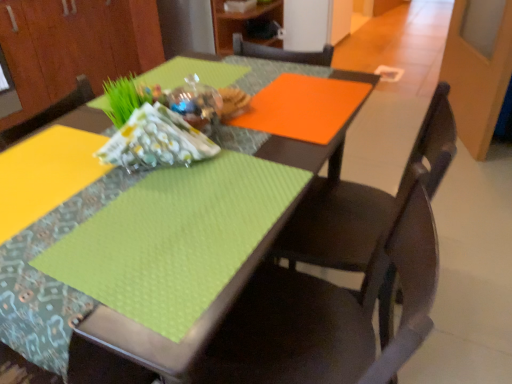
The image size is (512, 384). Describe the element at coordinates (156, 141) in the screenshot. I see `patterned fabric at center` at that location.

What is the approximate width of patterned fabric at center?

The width of patterned fabric at center is 2.16 inches.

The height and width of the screenshot is (384, 512). What do you see at coordinates (362, 202) in the screenshot?
I see `matte black chair at center, the first chair from the back` at bounding box center [362, 202].

This screenshot has height=384, width=512. Describe the element at coordinates (243, 24) in the screenshot. I see `matte wood cabinet at upper center, which appears as the first cabinetry when viewed from the right` at that location.

Where is `matte green placemat at lower left, which appears as the second chair when viewed from the back`? This screenshot has width=512, height=384. matte green placemat at lower left, which appears as the second chair when viewed from the back is located at coordinates (330, 313).

Could you measure the distance between matte wood cabinet at upper left, the second cabinetry positioned from the right, and patterned fabric at center?

7.29 feet.

Is matte wood cabinet at upper left, the second cabinetry positioned from the right, looking in the opposite direction of patterned fabric at center?

That's not correct — matte wood cabinet at upper left, the second cabinetry positioned from the right, is not looking away from patterned fabric at center.

Is patterned fabric at center completely or partially inside matte wood cabinet at upper left, which is the 1th cabinetry from left to right?

Definitely not — patterned fabric at center is not inside matte wood cabinet at upper left, which is the 1th cabinetry from left to right.

Looking at this image, is matte wood cabinet at upper left, the second cabinetry positioned from the right, thinner than patterned fabric at center?

In fact, matte wood cabinet at upper left, the second cabinetry positioned from the right, might be wider than patterned fabric at center.

Is matte black chair at center, which is the second chair from front to back, wider or thinner than patterned fabric at center?

Considering their sizes, matte black chair at center, which is the second chair from front to back, looks broader than patterned fabric at center.

Considering the relative sizes of matte black chair at center, the first chair from the back, and patterned fabric at center in the image provided, is matte black chair at center, the first chair from the back, taller than patterned fabric at center?

Indeed, matte black chair at center, the first chair from the back, has a greater height compared to patterned fabric at center.

Considering the positions of point (356, 238) and point (135, 114), is point (356, 238) closer or farther from the camera than point (135, 114)?

Point (356, 238) appears to be farther away from the viewer than point (135, 114).

Is matte black chair at center, which is the second chair from front to back, far away from patterned fabric at center?

No, matte black chair at center, which is the second chair from front to back, is not far from patterned fabric at center.

Is matte green placemat at lower left, which appears as the second chair when viewed from the back, completely or partially inside matte wood cabinet at upper left, the second cabinetry positioned from the right?

No.

Based on their sizes in the image, would you say matte wood cabinet at upper left, the second cabinetry positioned from the right, is bigger or smaller than matte green placemat at lower left, which appears as the second chair when viewed from the back?

Considering their sizes, matte wood cabinet at upper left, the second cabinetry positioned from the right, takes up more space than matte green placemat at lower left, which appears as the second chair when viewed from the back.

Locate an element on the screen. the 1st cabinetry positioned above the matte green placemat at lower left, positioned as the first chair in front-to-back order (from the image's perspective) is located at coordinates (74, 46).

Can you confirm if matte wood cabinet at upper left, the second cabinetry positioned from the right, is taller than matte green placemat at lower left, which appears as the second chair when viewed from the back?

No.

How much distance is there between matte green placemat at lower left, positioned as the first chair in front-to-back order, and patterned fabric at center?

matte green placemat at lower left, positioned as the first chair in front-to-back order, and patterned fabric at center are 16.17 inches apart from each other.

Which object is closer to the camera, matte green placemat at lower left, positioned as the first chair in front-to-back order, or patterned fabric at center?

matte green placemat at lower left, positioned as the first chair in front-to-back order, is in front.

In terms of width, does matte green placemat at lower left, which appears as the second chair when viewed from the back, look wider or thinner when compared to patterned fabric at center?

matte green placemat at lower left, which appears as the second chair when viewed from the back, is wider than patterned fabric at center.

From a real-world perspective, is matte green placemat at lower left, which appears as the second chair when viewed from the back, physically below patterned fabric at center?

Yes.

Based on the photo, which is closer, (83, 15) or (348, 209)?

Point (348, 209)

Considering the sizes of objects matte wood cabinet at upper left, which is the 1th cabinetry from left to right, and matte black chair at center, the first chair from the back, in the image provided, who is thinner, matte wood cabinet at upper left, which is the 1th cabinetry from left to right, or matte black chair at center, the first chair from the back,?

matte black chair at center, the first chair from the back, is thinner.

The width and height of the screenshot is (512, 384). I want to click on cabinetry that is the 1st one when counting upward from the matte black chair at center, the first chair from the back (from the image's perspective), so click(x=74, y=46).

In the scene shown: Is matte wood cabinet at upper left, which is the 1th cabinetry from left to right, to the right of matte black chair at center, the first chair from the back, from the viewer's perspective?

In fact, matte wood cabinet at upper left, which is the 1th cabinetry from left to right, is to the left of matte black chair at center, the first chair from the back.

Find the location of a particular element. The width and height of the screenshot is (512, 384). the 1st chair below the matte wood cabinet at upper center, which appears as the first cabinetry when viewed from the right (from the image's perspective) is located at coordinates (362, 202).

From the image's perspective, would you say matte black chair at center, which is the second chair from front to back, is shown under matte wood cabinet at upper center, which appears as the 2th cabinetry when viewed from the left?

Indeed, from the image's perspective, matte black chair at center, which is the second chair from front to back, is shown beneath matte wood cabinet at upper center, which appears as the 2th cabinetry when viewed from the left.

From a real-world perspective, who is located lower, matte black chair at center, the first chair from the back, or matte wood cabinet at upper center, which appears as the first cabinetry when viewed from the right?

From a 3D spatial view, matte black chair at center, the first chair from the back, is below.

In the scene shown: Is matte black chair at center, the first chair from the back, behind matte wood cabinet at upper center, which appears as the 2th cabinetry when viewed from the left?

No, it is in front of matte wood cabinet at upper center, which appears as the 2th cabinetry when viewed from the left.

Is the depth of patterned fabric at center greater than that of matte wood cabinet at upper left, the second cabinetry positioned from the right?

That is False.

Considering the sizes of objects patterned fabric at center and matte wood cabinet at upper left, which is the 1th cabinetry from left to right, in the image provided, who is smaller, patterned fabric at center or matte wood cabinet at upper left, which is the 1th cabinetry from left to right,?

Smaller between the two is patterned fabric at center.

Is patterned fabric at center facing towards matte wood cabinet at upper left, which is the 1th cabinetry from left to right?

No, patterned fabric at center is not aimed at matte wood cabinet at upper left, which is the 1th cabinetry from left to right.

From the picture: How far apart are patterned fabric at center and matte wood cabinet at upper left, the second cabinetry positioned from the right?

They are 7.29 feet apart.

You are a GUI agent. You are given a task and a screenshot of the screen. Output one action in this format:
    pyautogui.click(x=<x>, y=<y>)
    Task: Click on the material in front of the matte wood cabinet at upper left, the second cabinetry positioned from the right
    
    Given the screenshot: What is the action you would take?
    tap(156, 141)

Where is `chair behind the patterned fabric at center`? Image resolution: width=512 pixels, height=384 pixels. chair behind the patterned fabric at center is located at coordinates (362, 202).

Looking at the image, which one is located further to matte wood cabinet at upper center, which appears as the 2th cabinetry when viewed from the left, matte wood cabinet at upper left, the second cabinetry positioned from the right, or matte black chair at center, which is the second chair from front to back?

matte black chair at center, which is the second chair from front to back, is further to matte wood cabinet at upper center, which appears as the 2th cabinetry when viewed from the left.

From the image, which object appears to be farther from matte wood cabinet at upper left, which is the 1th cabinetry from left to right, matte wood cabinet at upper center, which appears as the 2th cabinetry when viewed from the left, or patterned fabric at center?

Among the two, patterned fabric at center is located further to matte wood cabinet at upper left, which is the 1th cabinetry from left to right.

Estimate the real-world distances between objects in this image. Which object is closer to matte black chair at center, the first chair from the back, matte wood cabinet at upper center, which appears as the 2th cabinetry when viewed from the left, or matte green placemat at lower left, positioned as the first chair in front-to-back order?

matte green placemat at lower left, positioned as the first chair in front-to-back order.

Considering their positions, is patterned fabric at center positioned further to matte green placemat at lower left, positioned as the first chair in front-to-back order, than matte black chair at center, which is the second chair from front to back?

patterned fabric at center lies further to matte green placemat at lower left, positioned as the first chair in front-to-back order, than the other object.

From the image, which object appears to be nearer to matte wood cabinet at upper left, the second cabinetry positioned from the right, matte green placemat at lower left, positioned as the first chair in front-to-back order, or matte black chair at center, the first chair from the back?

matte black chair at center, the first chair from the back, lies closer to matte wood cabinet at upper left, the second cabinetry positioned from the right, than the other object.

From the image, which object appears to be nearer to matte wood cabinet at upper center, which appears as the 2th cabinetry when viewed from the left, matte black chair at center, the first chair from the back, or patterned fabric at center?

matte black chair at center, the first chair from the back, is positioned closer to the anchor matte wood cabinet at upper center, which appears as the 2th cabinetry when viewed from the left.

When comparing their distances from matte black chair at center, which is the second chair from front to back, does matte green placemat at lower left, which appears as the second chair when viewed from the back, or matte wood cabinet at upper center, which appears as the 2th cabinetry when viewed from the left, seem closer?

matte green placemat at lower left, which appears as the second chair when viewed from the back.

Looking at this image, considering their positions, is matte black chair at center, which is the second chair from front to back, positioned further to matte wood cabinet at upper left, which is the 1th cabinetry from left to right, than matte wood cabinet at upper center, which appears as the 2th cabinetry when viewed from the left?

matte black chair at center, which is the second chair from front to back, is positioned further to the anchor matte wood cabinet at upper left, which is the 1th cabinetry from left to right.

Identify the location of chair between matte green placemat at lower left, which appears as the second chair when viewed from the back, and matte wood cabinet at upper center, which appears as the first cabinetry when viewed from the right, along the z-axis. The width and height of the screenshot is (512, 384). (362, 202).

Where is `chair between matte wood cabinet at upper left, which is the 1th cabinetry from left to right, and matte black chair at center, which is the second chair from front to back, from left to right`? The image size is (512, 384). chair between matte wood cabinet at upper left, which is the 1th cabinetry from left to right, and matte black chair at center, which is the second chair from front to back, from left to right is located at coordinates (330, 313).

Identify the location of material between matte green placemat at lower left, positioned as the first chair in front-to-back order, and matte wood cabinet at upper left, which is the 1th cabinetry from left to right, from front to back. (156, 141).

The image size is (512, 384). In order to click on material between matte green placemat at lower left, positioned as the first chair in front-to-back order, and matte wood cabinet at upper center, which appears as the 2th cabinetry when viewed from the left, in the front-back direction in this screenshot , I will do `click(156, 141)`.